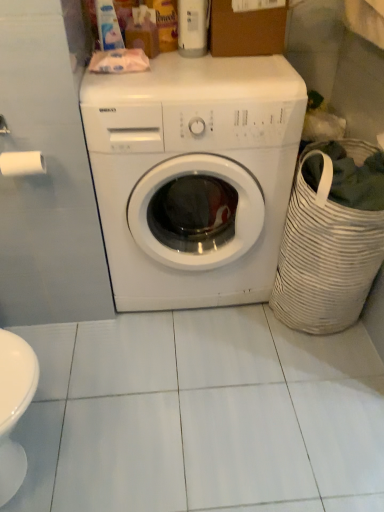
The width and height of the screenshot is (384, 512). Find the location of `empty space that is ontop of white glossy washing machine at center (from a real-world perspective)`. empty space that is ontop of white glossy washing machine at center (from a real-world perspective) is located at coordinates (199, 66).